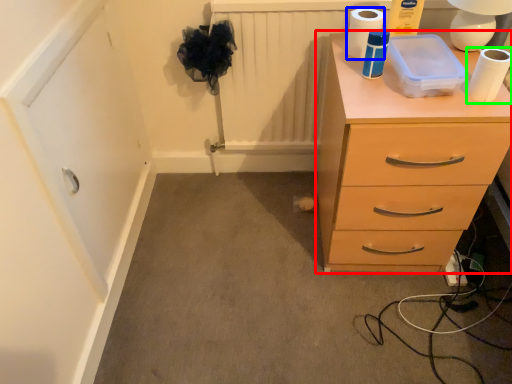
Question: Considering the real-world distances, which object is farthest from chest of drawers (highlighted by a red box)? toilet paper (highlighted by a blue box) or toilet paper (highlighted by a green box)?

Choices:
 (A) toilet paper
 (B) toilet paper

Answer: (A)